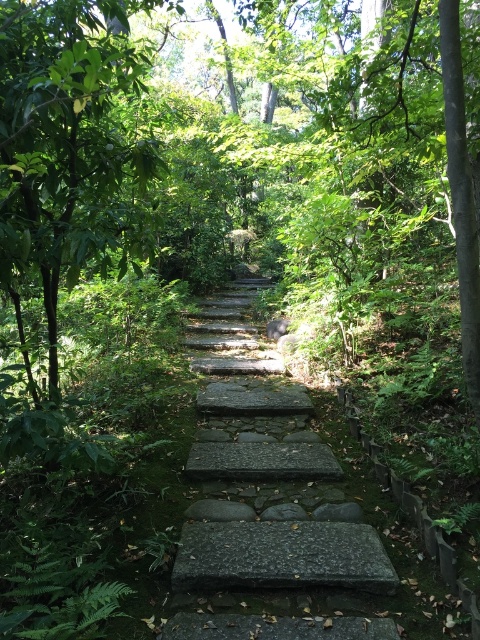
You are standing at the entrance of the forest path and see the green leafy tree at center and the gray stone stairs at center. Which object is positioned to the left when facing towards the deeper part of the forest?

The green leafy tree at center is positioned to the left of the gray stone stairs at center when facing towards the deeper part of the forest.

You are a hiker standing at the bottom of the gray stone stairs at center. You want to reach the green leafy tree at center. Which direction should you go?

The green leafy tree at center is positioned over the gray stone stairs at center, so you should go up the stairs to reach it.

You are standing at the starting point of the stone pathway in the forest. There are two points marked on the path. One is at coordinates point (134, 266) and the other is at point (228, 572). If you walk along the path towards the deeper part of the forest, which point will you encounter first?

You will first encounter point (228, 572) because point (134, 266) is located behind it along the path.